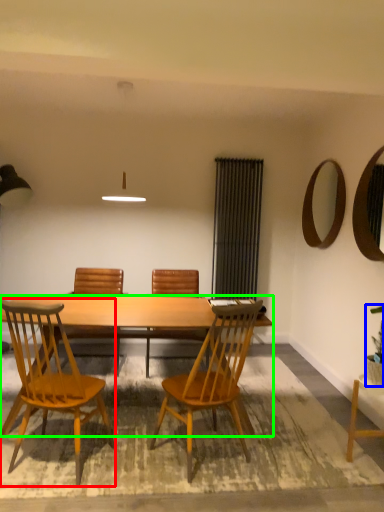
Question: Based on their relative distances, which object is farther from chair (highlighted by a red box)? Choose from houseplant (highlighted by a blue box) and desk (highlighted by a green box).

Choices:
 (A) houseplant
 (B) desk

Answer: (A)